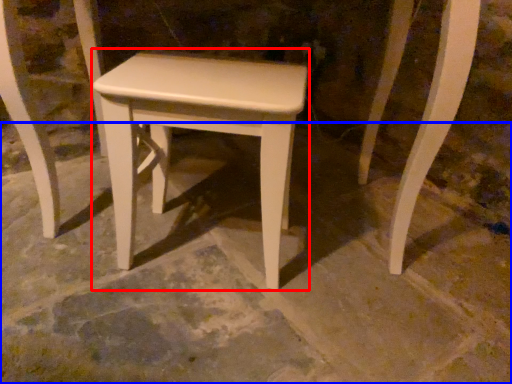
Question: Which object appears closest to the camera in this image, stool (highlighted by a red box) or concrete (highlighted by a blue box)?

Choices:
 (A) stool
 (B) concrete

Answer: (B)